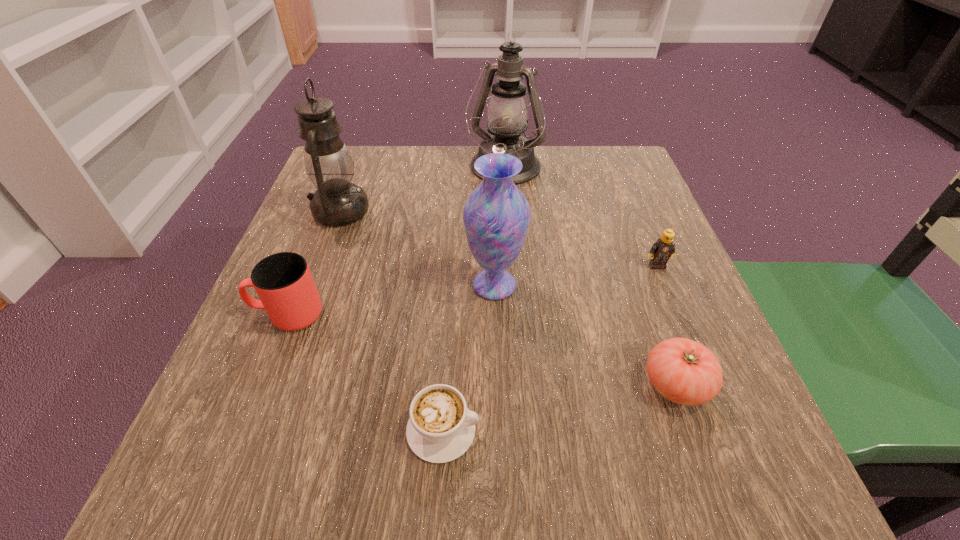
Find the location of a particular element. The height and width of the screenshot is (540, 960). vacant region located in front of the Lego is located at coordinates (679, 319).

The image size is (960, 540). Identify the location of vacant space located on the back of the tomato. (638, 279).

Image resolution: width=960 pixels, height=540 pixels. I want to click on vacant area situated to the right of the cappuccino's handle, so click(647, 430).

This screenshot has width=960, height=540. Find the location of `object positioned at the near edge`. object positioned at the near edge is located at coordinates (441, 428).

Identify the location of oil lamp present at the left edge. (x=337, y=202).

You are a GUI agent. You are given a task and a screenshot of the screen. Output one action in this format:
    pyautogui.click(x=<x>, y=<y>)
    Task: Click on the cup that is at the left edge
    The image size is (960, 540).
    Given the screenshot: What is the action you would take?
    pyautogui.click(x=283, y=281)

The height and width of the screenshot is (540, 960). I want to click on Lego that is at the right edge, so click(664, 248).

The image size is (960, 540). In order to click on tomato located at the right edge in this screenshot , I will do `click(686, 372)`.

Where is `object that is at the far left corner`? This screenshot has height=540, width=960. object that is at the far left corner is located at coordinates (337, 202).

At what (x,y) coordinates should I click in order to perform the action: click on vacant region at the far edge of the desktop. Please return your answer as a coordinate pair (x, y). Image resolution: width=960 pixels, height=540 pixels. Looking at the image, I should click on (442, 161).